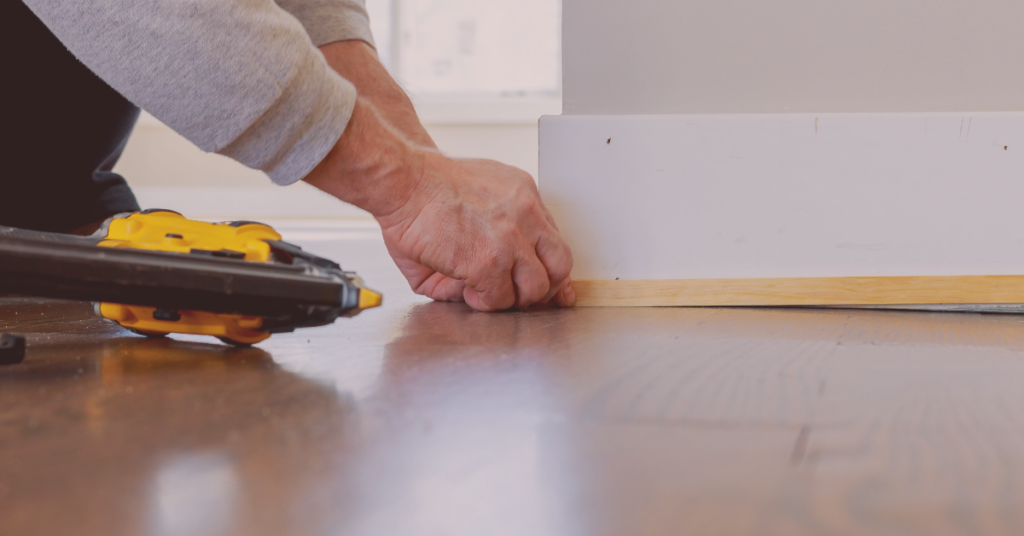
Locate an element on the screen. molding is located at coordinates (674, 193).